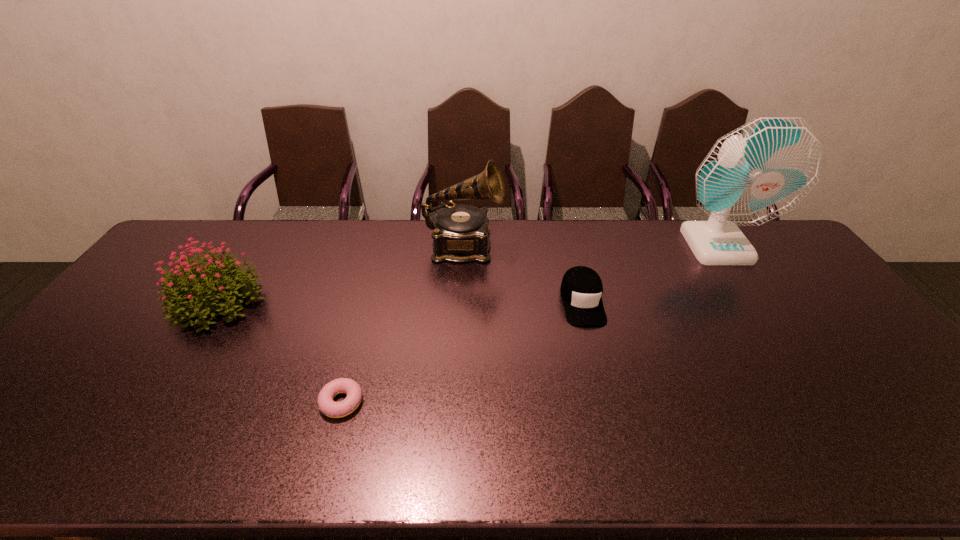
I want to click on unoccupied area between the second shortest object and the nearest object, so click(462, 352).

Locate an element on the screen. This screenshot has height=540, width=960. free space between the fourth tallest object and the leftmost object is located at coordinates (400, 301).

Where is `vacant point located between the third object from left to right and the tallest object`? vacant point located between the third object from left to right and the tallest object is located at coordinates (589, 246).

This screenshot has height=540, width=960. Find the location of `unoccupied area between the fan and the fourth tallest object`. unoccupied area between the fan and the fourth tallest object is located at coordinates (649, 273).

Find the location of a particular element. The height and width of the screenshot is (540, 960). object that is the closest to the bouquet is located at coordinates (326, 404).

Image resolution: width=960 pixels, height=540 pixels. Identify the location of object that is the third closest to the phonograph record. (326, 404).

Identify the location of vacant space that satisfies the following two spatial constraints: 1. on the horn of the second tallest object; 2. on the front side of the second object from left to right. This screenshot has height=540, width=960. (457, 402).